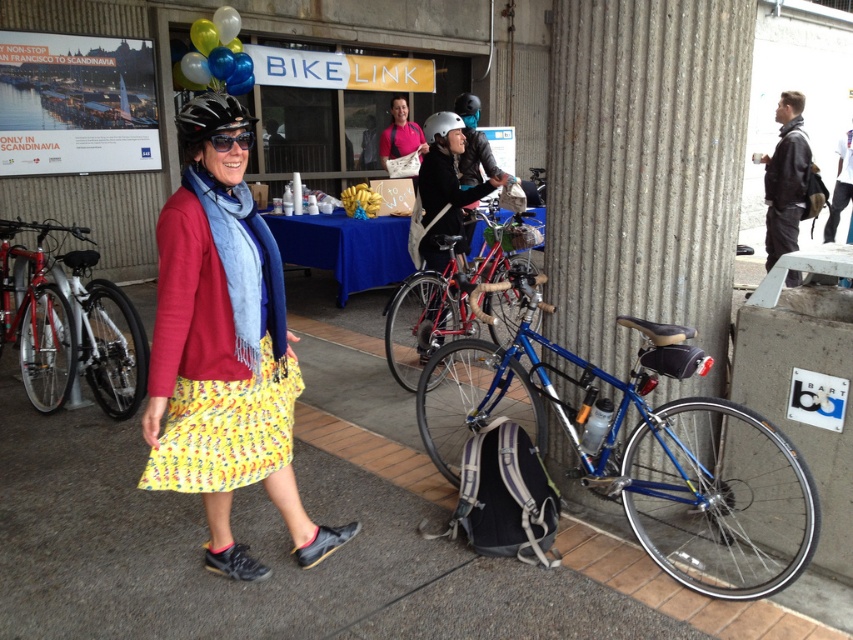
Question: Which object is positioned closest to the matte white helmet at center?

Choices:
 (A) shiny metallic balloons at upper left
 (B) blue metallic bicycle at lower right
 (C) concrete at center
 (D) shiny black bicycle at left

Answer: (C)

Question: Is concrete at center closer to the viewer compared to shiny metallic balloons at upper left?

Choices:
 (A) yes
 (B) no

Answer: (A)

Question: Which is nearer to the matte black helmet at center?

Choices:
 (A) silver metallic bicycle at left
 (B) shiny black bicycle at left
 (C) shiny blue bicycle at center
 (D) pink fabric shirt at center

Answer: (C)

Question: Does matte black helmet at center appear under matte black helmet at upper left?

Choices:
 (A) yes
 (B) no

Answer: (B)

Question: Which object is the farthest from the matte black helmet at center?

Choices:
 (A) shiny black bicycle at left
 (B) blue metallic bicycle at lower right
 (C) silver metallic bicycle at left

Answer: (C)

Question: Can you confirm if matte red sweater at center is positioned to the right of shiny black bicycle at left?

Choices:
 (A) yes
 (B) no

Answer: (A)